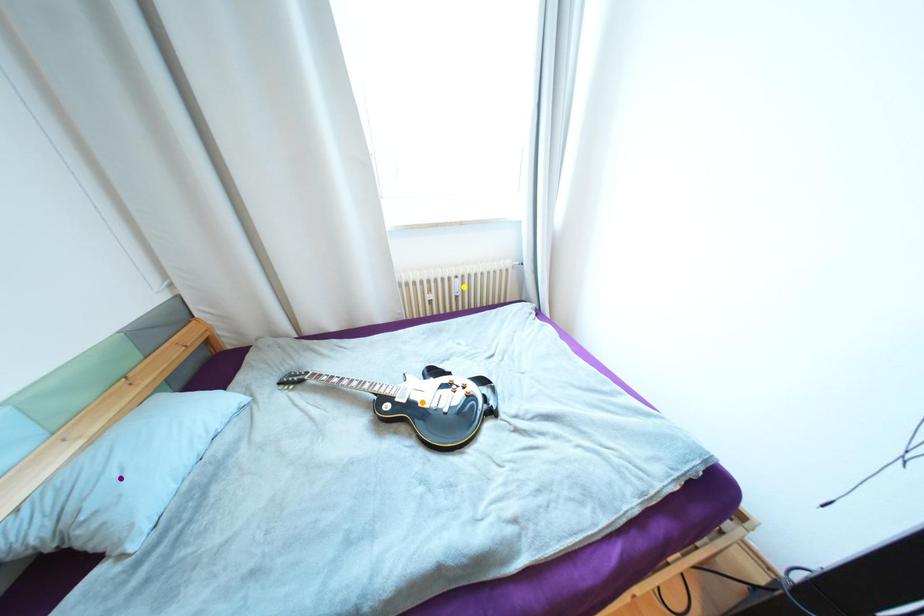
Order these from nearest to farthest:
1. purple point
2. orange point
3. yellow point

purple point, orange point, yellow point